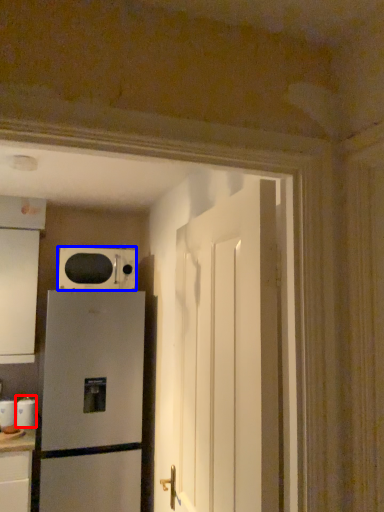
Question: Which point is further to the camera, appliance (highlighted by a red box) or microwave oven (highlighted by a blue box)?

Choices:
 (A) appliance
 (B) microwave oven

Answer: (A)